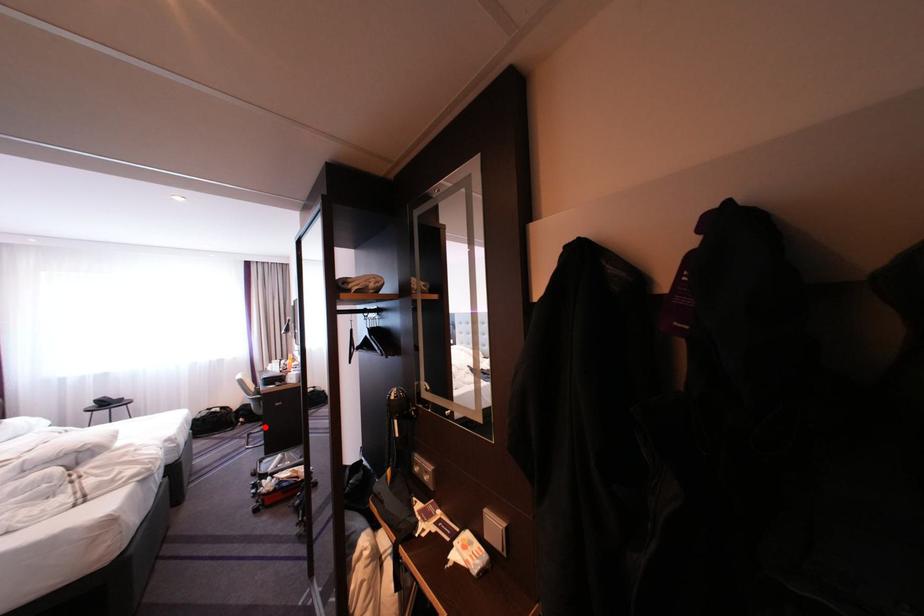
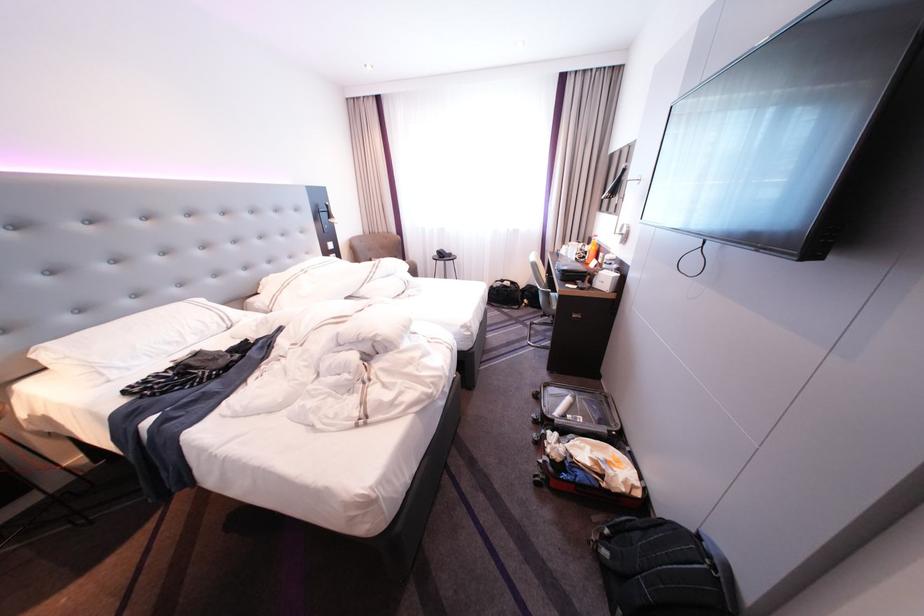
The point at the highlighted location is marked in the first image. Where is the corresponding point in the second image?

(546, 314)